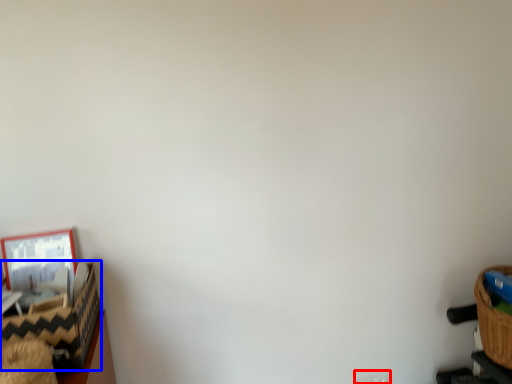
Question: Which object is further to the camera taking this photo, electric outlet (highlighted by a red box) or basket (highlighted by a blue box)?

Choices:
 (A) electric outlet
 (B) basket

Answer: (A)